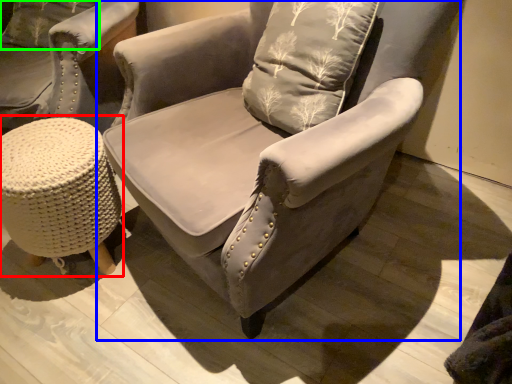
Question: Considering the real-world distances, which object is closest to music stool (highlighted by a red box)? chair (highlighted by a blue box) or pillow (highlighted by a green box).

Choices:
 (A) chair
 (B) pillow

Answer: (A)